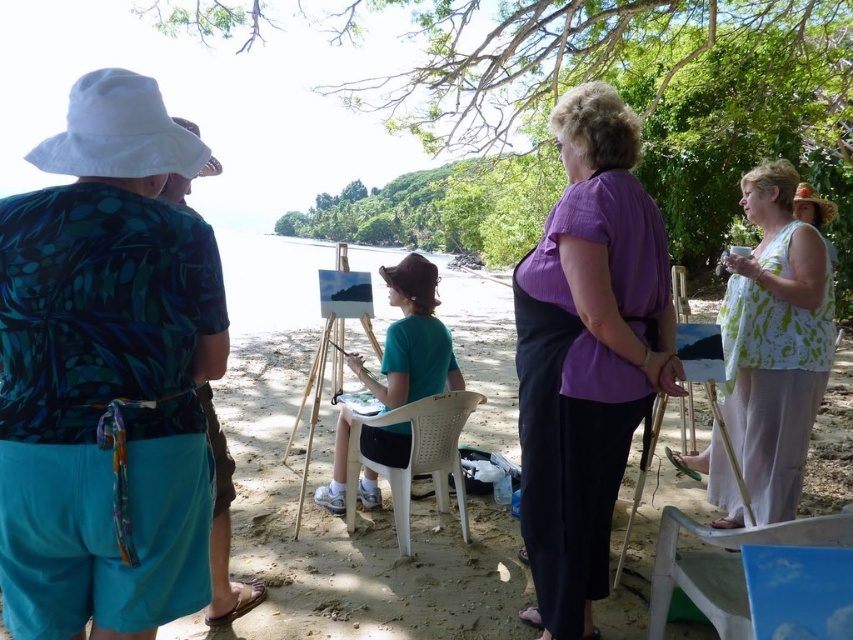
Based on the photo, you are standing at the center of the beachside scene and want to find the point at coordinates [775,340]. Which object is this point located on?

The point at coordinates [775,340] is located on the white printed blouse at center.

You are a photographer at the beachside scene and want to capture both the white printed blouse at center and the matte green shirt at left in a single frame. Since you want to ensure both are visible, which clothing item should you focus on to frame the shot so that both fit properly?

The white printed blouse at center is larger in size compared to the matte green shirt at left, so you should frame the shot around the larger white printed blouse at center to ensure both items fit within the frame.